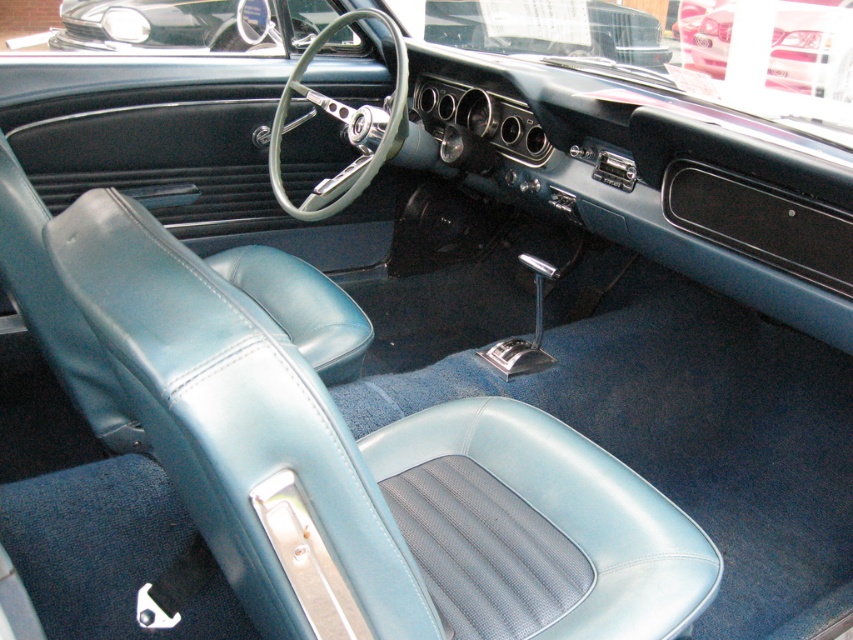
Question: Is shiny chrome steering wheel at upper center below metallic silver car at upper center?

Choices:
 (A) yes
 (B) no

Answer: (A)

Question: Is shiny chrome steering wheel at upper center smaller than metallic silver car at upper center?

Choices:
 (A) no
 (B) yes

Answer: (A)

Question: Which point appears farthest from the camera in this image?

Choices:
 (A) [x=218, y=20]
 (B) [x=695, y=65]

Answer: (B)

Question: Where is shiny chrome steering wheel at upper center located in relation to metallic silver car at upper center in the image?

Choices:
 (A) below
 (B) above

Answer: (A)

Question: Which point is closer to the camera?

Choices:
 (A) pos(825,51)
 (B) pos(329,16)

Answer: (B)